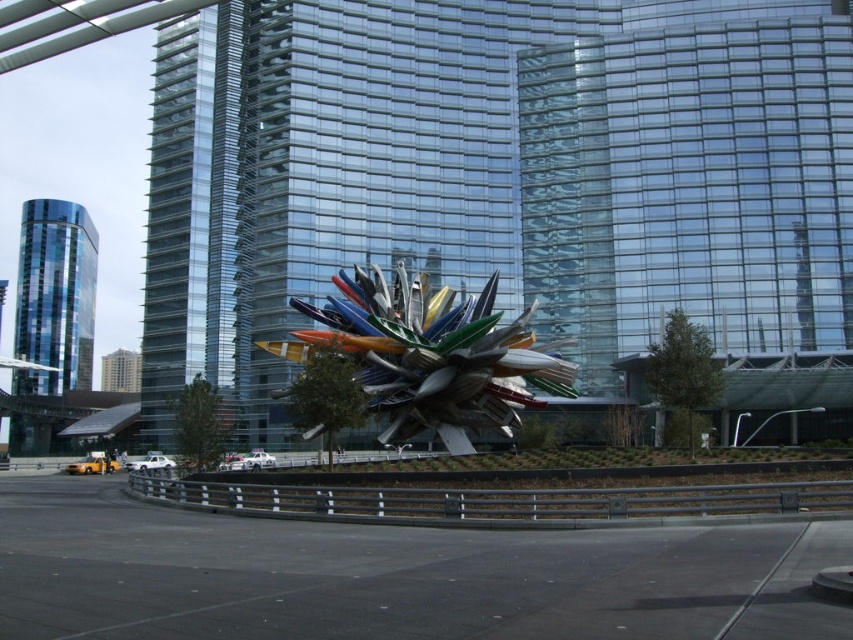
You are a city planner reviewing the layout of the urban area. You need to determine if the transparent glass tower at center and the blue glass tower at left are aligned in a way that allows for a clear view of both from the main plaza. Based on their positions, can you confirm if they are stacked vertically or placed side by side?

The transparent glass tower at center is positioned over the blue glass tower at left, meaning they are stacked vertically rather than placed side by side. This vertical alignment may limit the visibility of the lower tower from certain angles depending on the plaza layout.